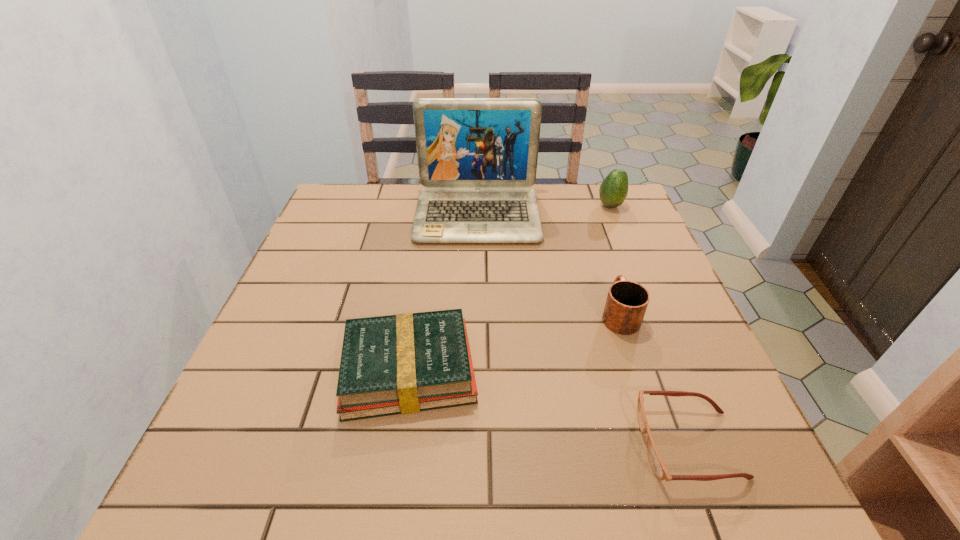
Where is `free point between the second shortest object and the avocado`? This screenshot has width=960, height=540. free point between the second shortest object and the avocado is located at coordinates (510, 288).

In order to click on vacant region between the spectacles and the tallest object in this screenshot , I will do `click(584, 330)`.

Find the location of `empty location between the shortest object and the hardback book`. empty location between the shortest object and the hardback book is located at coordinates (549, 407).

At what (x,y) coordinates should I click in order to perform the action: click on blank region between the fourth shortest object and the shortest object. Please return your answer as a coordinate pair (x, y). Looking at the image, I should click on (650, 325).

Where is `unoccupied area between the tallest object and the fourth tallest object`? The height and width of the screenshot is (540, 960). unoccupied area between the tallest object and the fourth tallest object is located at coordinates (443, 292).

Find the location of a particular element. The image size is (960, 540). vacant space in between the avocado and the shortest object is located at coordinates 650,325.

This screenshot has height=540, width=960. I want to click on vacant point located between the shortest object and the third shortest object, so (654, 379).

You are a GUI agent. You are given a task and a screenshot of the screen. Output one action in this format:
    pyautogui.click(x=<x>, y=<y>)
    Task: Click on the object that stands as the third closest to the second shortest object
    
    Given the screenshot: What is the action you would take?
    pyautogui.click(x=477, y=157)

Point out which object is positioned as the nearest to the spectacles. Please provide its 2D coordinates. Your answer should be formatted as a tuple, i.e. [(x, y)], where the tuple contains the x and y coordinates of a point satisfying the conditions above.

[(627, 301)]